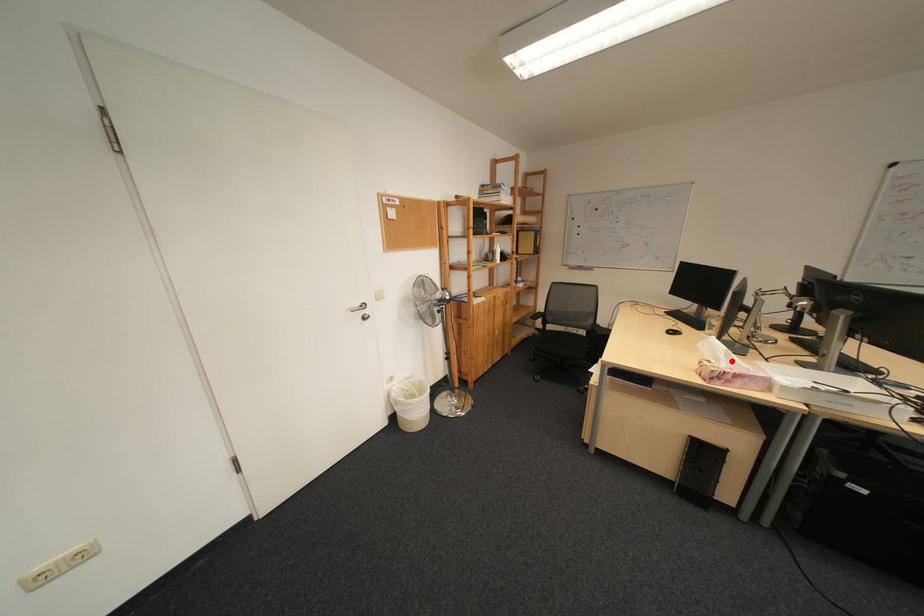
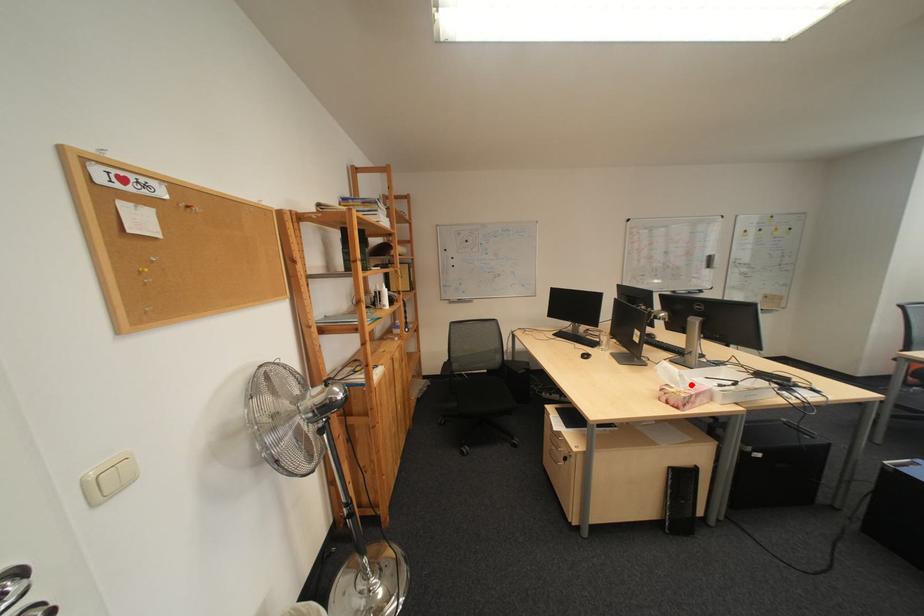
I am providing you with two images of the same scene from different viewpoints. A red point is marked on the first image and another point is marked on the second image. Do the highlighted points in image1 and image2 indicate the same real-world spot?

Yes